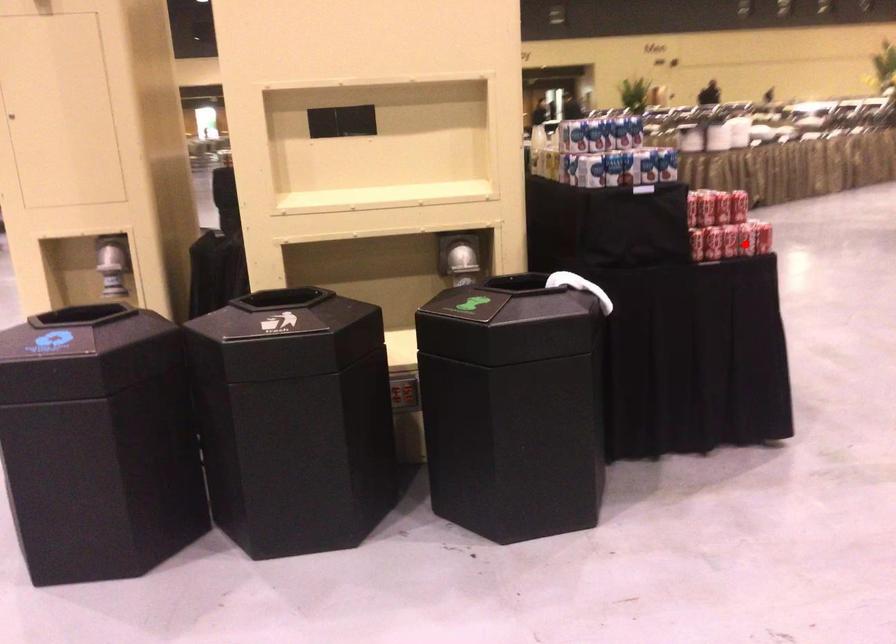
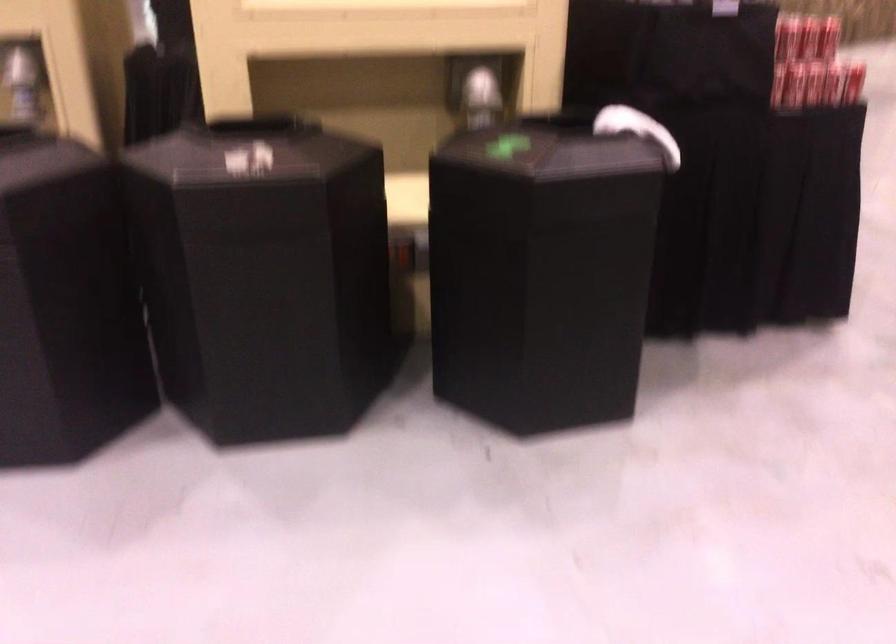
Where in the second image is the point corresponding to the highlighted location from the first image?

(833, 84)